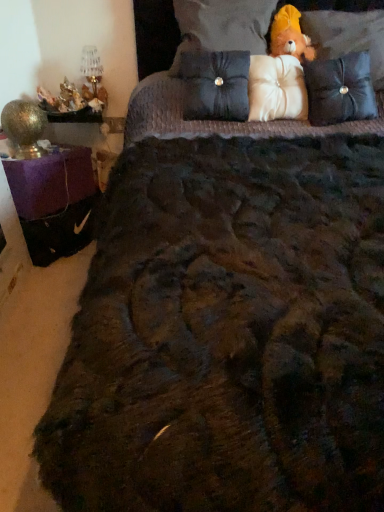
Question: Looking at their shapes, would you say white fabric pillow at center, the 3th pillow viewed from the right, is wider or thinner than black quilted pillow at center, the first pillow viewed from the left?

Choices:
 (A) thin
 (B) wide

Answer: (B)

Question: Is white fabric pillow at center, acting as the 3th pillow starting from the left, bigger or smaller than black quilted pillow at center, placed as the 5th pillow when sorted from right to left?

Choices:
 (A) small
 (B) big

Answer: (A)

Question: Estimate the real-world distances between objects in this image. Which object is closer to the black quilted pillow at center, placed as the 5th pillow when sorted from right to left?

Choices:
 (A) velvet-like brown pillow at upper right, the fourth pillow positioned from the left
 (B) white satin pillow at upper center, which is the fourth pillow from right to left
 (C) velvet black pillow at upper right, which ranks as the first pillow in right-to-left order
 (D) fuzzy brown teddy bear at upper right
 (E) white fabric pillow at center, acting as the 3th pillow starting from the left

Answer: (E)

Question: Which of these objects is positioned closest to the white fabric pillow at center, acting as the 3th pillow starting from the left?

Choices:
 (A) velvet black pillow at upper right, which ranks as the first pillow in right-to-left order
 (B) black quilted pillow at center, placed as the 5th pillow when sorted from right to left
 (C) white satin pillow at upper center, which is the fourth pillow from right to left
 (D) fuzzy brown teddy bear at upper right
 (E) velvet-like brown pillow at upper right, the fourth pillow positioned from the left

Answer: (B)